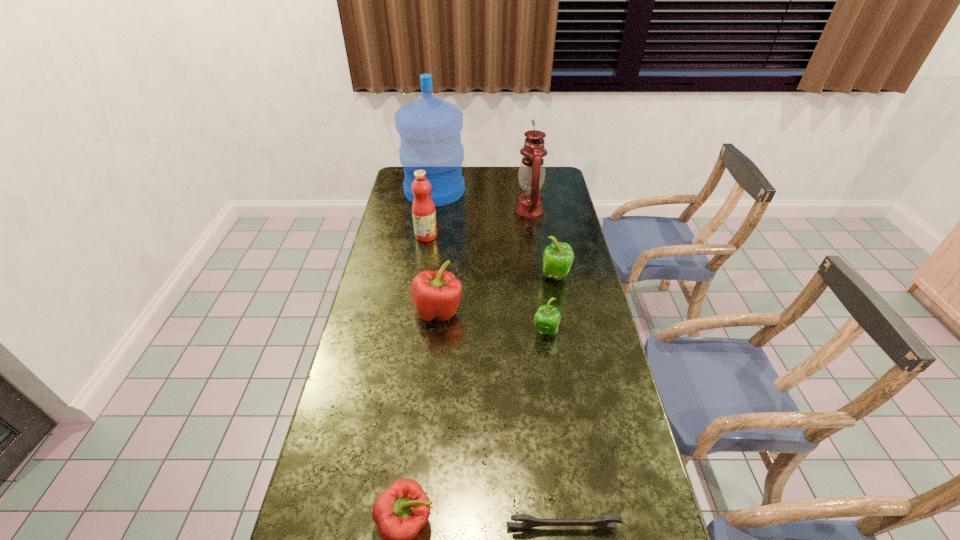
Where is `oil lamp located in the right edge section of the desktop`? oil lamp located in the right edge section of the desktop is located at coordinates (531, 175).

Locate an element on the screen. This screenshot has width=960, height=540. wrench that is at the right edge is located at coordinates (603, 522).

At what (x,y) coordinates should I click in order to perform the action: click on object that is positioned at the far left corner. Please return your answer as a coordinate pair (x, y). This screenshot has height=540, width=960. Looking at the image, I should click on (430, 128).

The width and height of the screenshot is (960, 540). In order to click on vacant region at the far edge of the desktop in this screenshot , I will do `click(485, 187)`.

I want to click on vacant point at the left edge, so click(x=359, y=429).

Image resolution: width=960 pixels, height=540 pixels. In order to click on blank area at the right edge in this screenshot , I will do `click(542, 207)`.

Locate an element on the screen. The width and height of the screenshot is (960, 540). empty space that is in between the pink fruit juice and the fifth nearest object is located at coordinates (491, 256).

The width and height of the screenshot is (960, 540). In order to click on vacant point located between the farther green bell pepper and the bigger pink bell pepper in this screenshot , I will do `click(496, 294)`.

Identify the location of empty space between the nearer green bell pepper and the fourth farthest object. (550, 305).

Find the location of a particular element. The height and width of the screenshot is (540, 960). empty location between the bigger green bell pepper and the farther pink bell pepper is located at coordinates (496, 294).